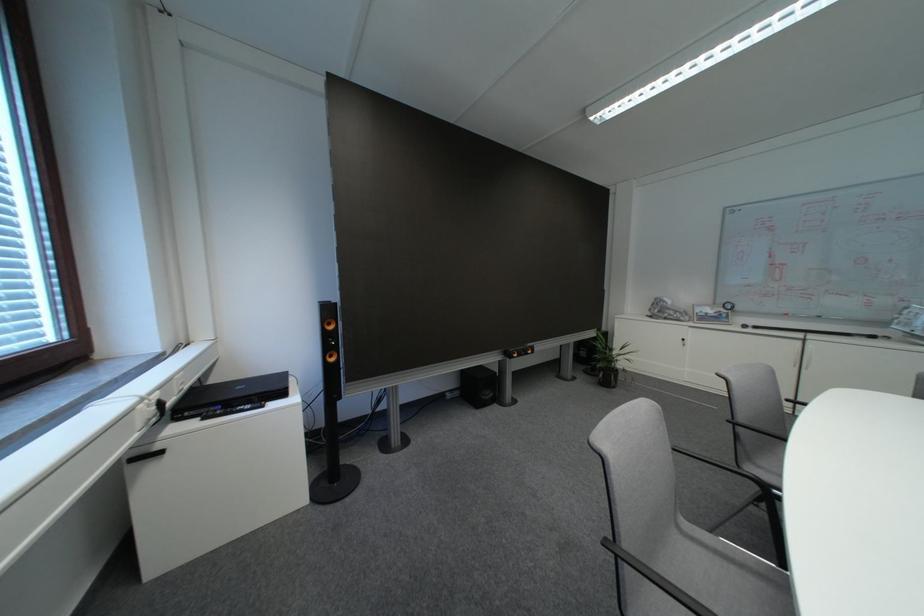
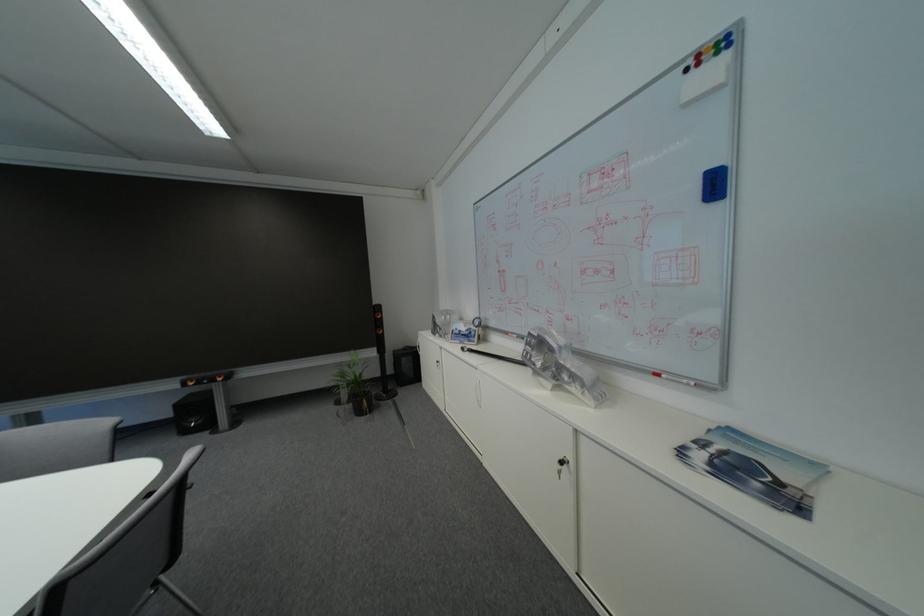
Question: In a continuous first-person perspective shot, in which direction is the camera moving?

Choices:
 (A) Left
 (B) Right
 (C) Forward
 (D) Backward

Answer: (B)